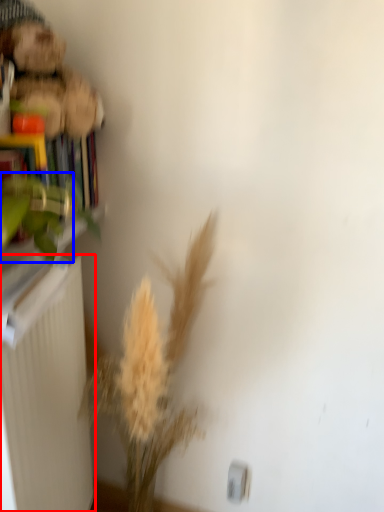
Question: Which object appears farthest to the camera in this image, radiator (highlighted by a red box) or plant (highlighted by a blue box)?

Choices:
 (A) radiator
 (B) plant

Answer: (B)